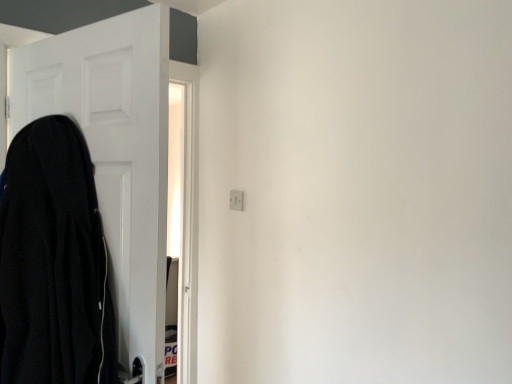
Question: Considering the relative sizes of white matte door at left and black matte coat at left in the image provided, is white matte door at left bigger than black matte coat at left?

Choices:
 (A) yes
 (B) no

Answer: (A)

Question: Considering the relative sizes of white matte door at left and black matte coat at left in the image provided, is white matte door at left taller than black matte coat at left?

Choices:
 (A) yes
 (B) no

Answer: (A)

Question: Is white matte door at left at the right side of black matte coat at left?

Choices:
 (A) yes
 (B) no

Answer: (A)

Question: From a real-world perspective, is white matte door at left located beneath black matte coat at left?

Choices:
 (A) no
 (B) yes

Answer: (A)

Question: From the image's perspective, is white matte door at left beneath black matte coat at left?

Choices:
 (A) yes
 (B) no

Answer: (B)

Question: From a real-world perspective, is white plastic electric outlet at upper center positioned above or below black matte coat at left?

Choices:
 (A) above
 (B) below

Answer: (A)

Question: Is white plastic electric outlet at upper center spatially inside black matte coat at left, or outside of it?

Choices:
 (A) inside
 (B) outside

Answer: (B)

Question: Relative to black matte coat at left, is white plastic electric outlet at upper center in front or behind?

Choices:
 (A) behind
 (B) front

Answer: (A)

Question: Is point (239, 205) positioned closer to the camera than point (31, 357)?

Choices:
 (A) farther
 (B) closer

Answer: (A)

Question: From the image's perspective, is white matte door at left located above or below white plastic electric outlet at upper center?

Choices:
 (A) below
 (B) above

Answer: (A)

Question: Is white matte door at left bigger or smaller than white plastic electric outlet at upper center?

Choices:
 (A) small
 (B) big

Answer: (B)

Question: Is white matte door at left in front of or behind white plastic electric outlet at upper center in the image?

Choices:
 (A) behind
 (B) front

Answer: (B)

Question: Is white matte door at left wider or thinner than white plastic electric outlet at upper center?

Choices:
 (A) wide
 (B) thin

Answer: (A)

Question: From a real-world perspective, is white plastic electric outlet at upper center positioned above or below white matte door at left?

Choices:
 (A) above
 (B) below

Answer: (A)

Question: Based on their sizes in the image, would you say white plastic electric outlet at upper center is bigger or smaller than white matte door at left?

Choices:
 (A) big
 (B) small

Answer: (B)